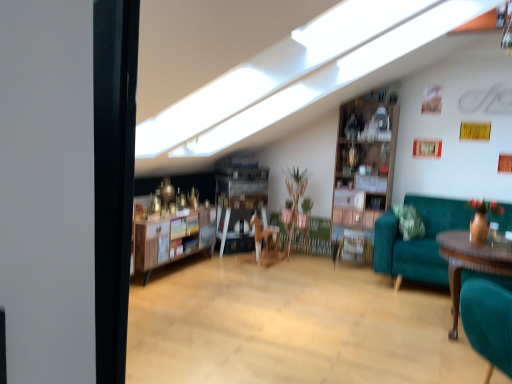
Question: Can you confirm if wooden shelf at center is thinner than wooden polished table at right?

Choices:
 (A) yes
 (B) no

Answer: (A)

Question: From the image's perspective, is wooden shelf at center over wooden polished table at right?

Choices:
 (A) no
 (B) yes

Answer: (B)

Question: Can you confirm if wooden shelf at center is shorter than wooden polished table at right?

Choices:
 (A) no
 (B) yes

Answer: (B)

Question: Is wooden shelf at center bigger than wooden polished table at right?

Choices:
 (A) no
 (B) yes

Answer: (A)

Question: From a real-world perspective, does wooden shelf at center sit lower than wooden polished table at right?

Choices:
 (A) yes
 (B) no

Answer: (A)

Question: From the image's perspective, is wooden polished table at right above or below wooden shelf at center?

Choices:
 (A) above
 (B) below

Answer: (B)

Question: Considering the positions of wooden polished table at right and wooden shelf at center in the image, is wooden polished table at right wider or thinner than wooden shelf at center?

Choices:
 (A) wide
 (B) thin

Answer: (A)

Question: From a real-world perspective, is wooden polished table at right positioned above or below wooden shelf at center?

Choices:
 (A) above
 (B) below

Answer: (A)

Question: Looking at the image, does wooden polished table at right seem bigger or smaller compared to wooden shelf at center?

Choices:
 (A) big
 (B) small

Answer: (A)

Question: Is wooden shelf at center in front of or behind teal fabric couch at right in the image?

Choices:
 (A) behind
 (B) front

Answer: (A)

Question: Choose the correct answer: Is wooden shelf at center inside teal fabric couch at right or outside it?

Choices:
 (A) inside
 (B) outside

Answer: (B)

Question: Is wooden shelf at center wider or thinner than teal fabric couch at right?

Choices:
 (A) wide
 (B) thin

Answer: (B)

Question: Is wooden shelf at center bigger or smaller than teal fabric couch at right?

Choices:
 (A) small
 (B) big

Answer: (A)

Question: Is point (399, 251) positioned closer to the camera than point (224, 225)?

Choices:
 (A) farther
 (B) closer

Answer: (B)

Question: From the image's perspective, is teal fabric couch at right located above or below wooden shelf at center?

Choices:
 (A) below
 (B) above

Answer: (A)